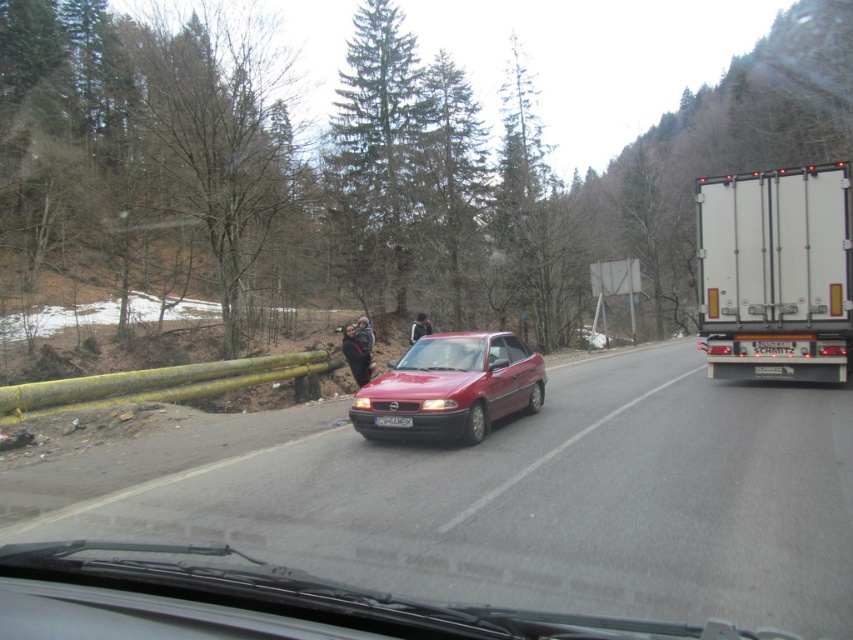
Can you confirm if smooth asphalt road at center is positioned below black plastic license plate at center?

Yes, smooth asphalt road at center is below black plastic license plate at center.

Find the location of a particular element. This screenshot has width=853, height=640. smooth asphalt road at center is located at coordinates (511, 497).

Is black plastic license plate at center to the right of black leather jacket at center from the viewer's perspective?

Correct, you'll find black plastic license plate at center to the right of black leather jacket at center.

Does black plastic license plate at center lie in front of black leather jacket at center?

Yes, black plastic license plate at center is closer to the viewer.

Which is in front, point (779, 365) or point (413, 323)?

Point (779, 365) is in front.

Image resolution: width=853 pixels, height=640 pixels. In order to click on black plastic license plate at center in this screenshot , I will do `click(773, 371)`.

Which is above, dark brown leather jacket at center or black plastic license plate at center?

black plastic license plate at center

Between dark brown leather jacket at center and black plastic license plate at center, which one is positioned lower?

dark brown leather jacket at center is lower down.

Is point (366, 348) more distant than point (788, 369)?

Yes, it is behind point (788, 369).

This screenshot has height=640, width=853. In order to click on dark brown leather jacket at center in this screenshot , I will do `click(357, 353)`.